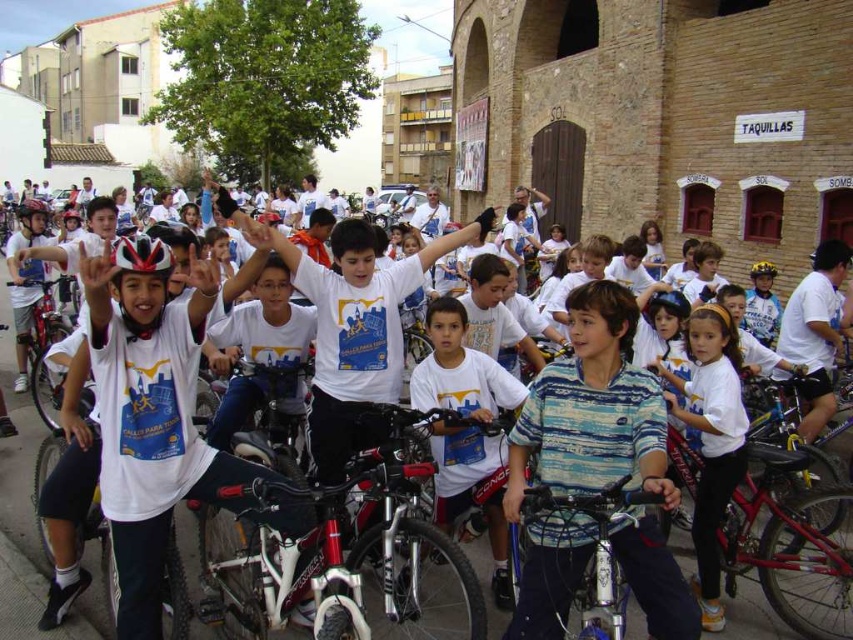
Is point (688, 301) in front of point (77, 220)?

Yes, point (688, 301) is closer to viewer.

Based on the photo, is matte black helmet at center bigger than matte white helmet at center?

Actually, matte black helmet at center might be smaller than matte white helmet at center.

Where is `matte black helmet at center`? The width and height of the screenshot is (853, 640). matte black helmet at center is located at coordinates (669, 304).

Is the position of white cotton shirt at center more distant than that of metallic blue bicycle at center?

Yes, it is behind metallic blue bicycle at center.

Can you confirm if white cotton shirt at center is positioned to the right of metallic blue bicycle at center?

Indeed, white cotton shirt at center is positioned on the right side of metallic blue bicycle at center.

Describe the element at coordinates (711, 438) in the screenshot. This screenshot has width=853, height=640. I see `white cotton shirt at center` at that location.

The width and height of the screenshot is (853, 640). I want to click on white cotton shirt at center, so click(711, 438).

Is white matte bicycle helmet at upper left above yellow matte bicycle helmet at upper center?

Yes.

Is white matte bicycle helmet at upper left thinner than yellow matte bicycle helmet at upper center?

Incorrect, white matte bicycle helmet at upper left's width is not less than yellow matte bicycle helmet at upper center's.

Between point (30, 224) and point (767, 262), which one is positioned behind?

The point (30, 224) is behind.

Where is `white matte bicycle helmet at upper left`? This screenshot has height=640, width=853. white matte bicycle helmet at upper left is located at coordinates (33, 216).